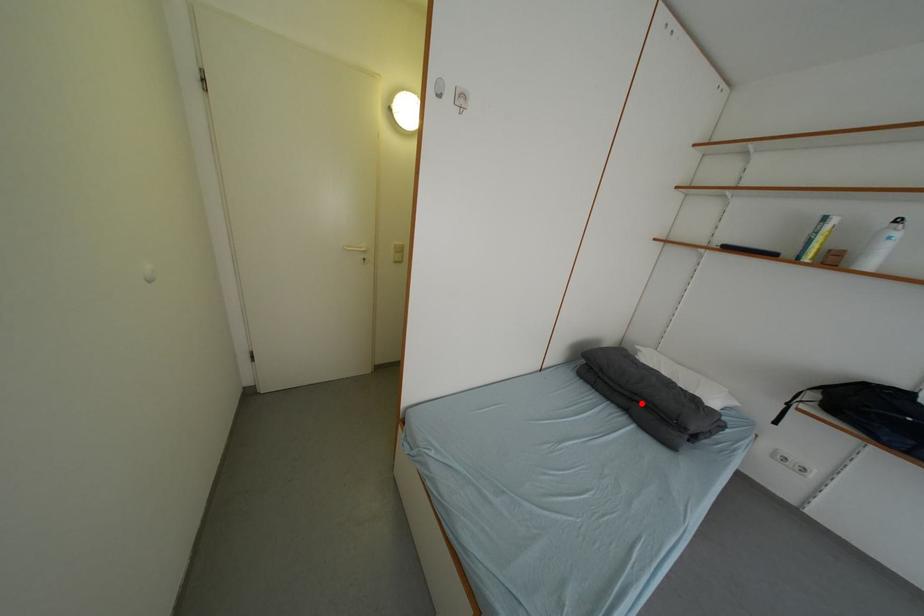
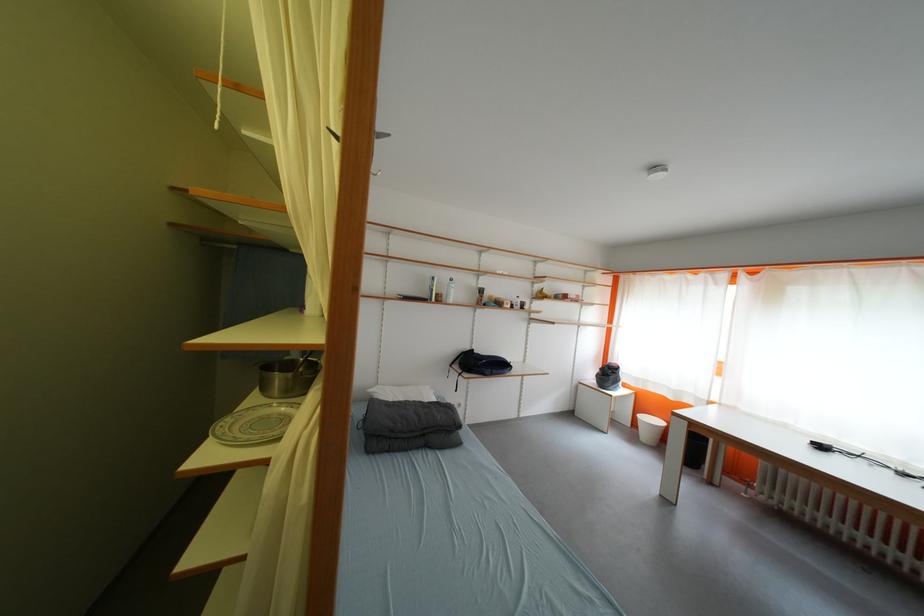
Locate, in the second image, the point that corresponds to the highlighted location in the first image.

(432, 438)